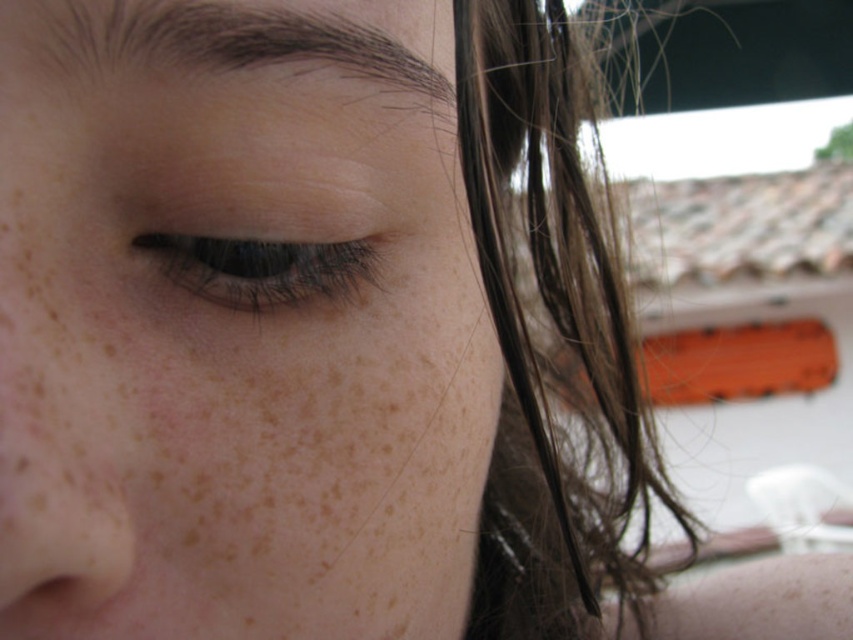
Is freckled skin at center thinner than brown silky hair at right?

Correct, freckled skin at center's width is less than brown silky hair at right's.

Who is shorter, freckled skin at center or brown silky hair at right?

freckled skin at center

Which is behind, point (254, 508) or point (509, 538)?

The point (509, 538) is behind.

Locate an element on the screen. This screenshot has width=853, height=640. freckled skin at center is located at coordinates (236, 321).

Is smooth skin nose at lower left taller than brown matte eye at upper left?

Correct, smooth skin nose at lower left is much taller as brown matte eye at upper left.

What do you see at coordinates (57, 528) in the screenshot? The width and height of the screenshot is (853, 640). I see `smooth skin nose at lower left` at bounding box center [57, 528].

The height and width of the screenshot is (640, 853). In order to click on smooth skin nose at lower left in this screenshot , I will do `click(57, 528)`.

Which is below, freckled skin at center or brown matte eye at upper left?

freckled skin at center is below.

Does point (368, 340) come in front of point (264, 241)?

No, (368, 340) is further to viewer.

Locate an element on the screen. The image size is (853, 640). freckled skin at center is located at coordinates (236, 321).